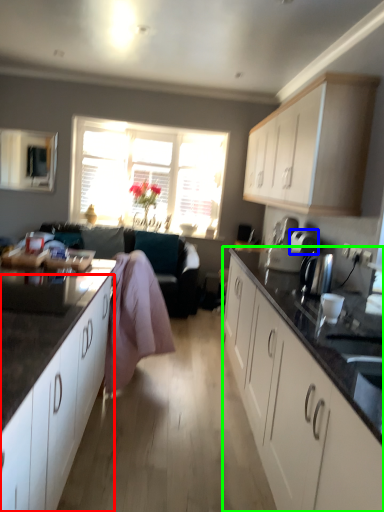
Question: Based on their relative distances, which object is farther from cabinetry (highlighted by a red box)? Choose from appliance (highlighted by a blue box) and cabinetry (highlighted by a green box).

Choices:
 (A) appliance
 (B) cabinetry

Answer: (A)